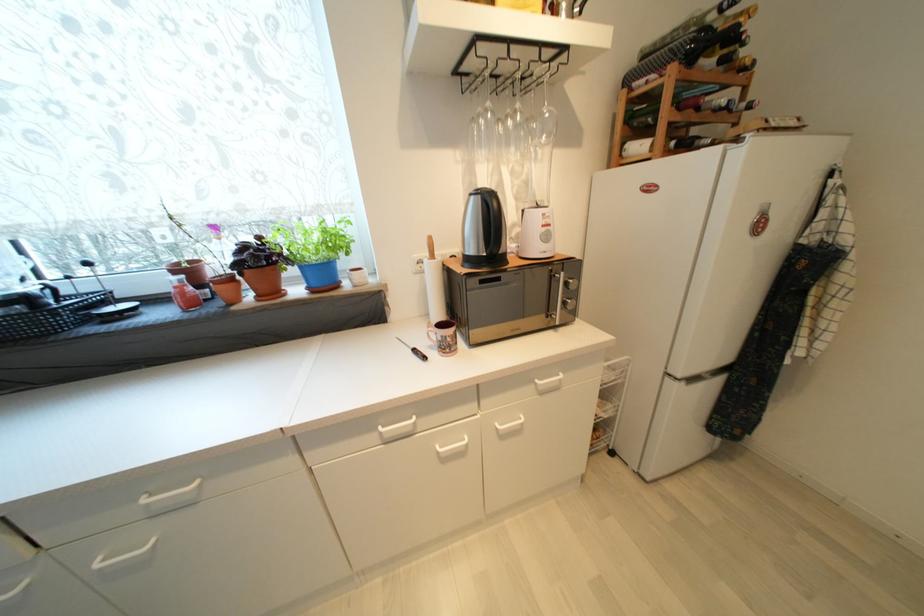
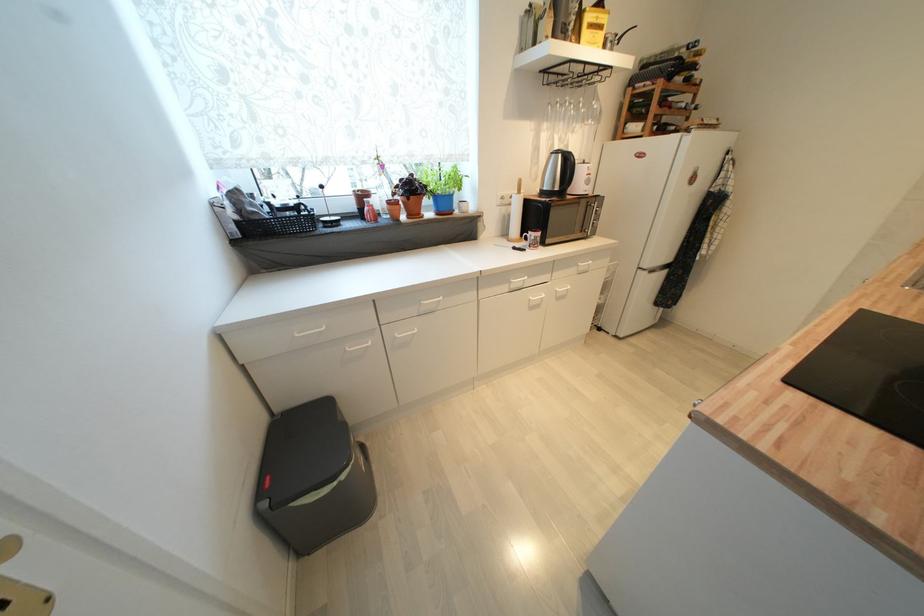
In the second image, find the point that corresponds to (x=736, y=136) in the first image.

(690, 127)